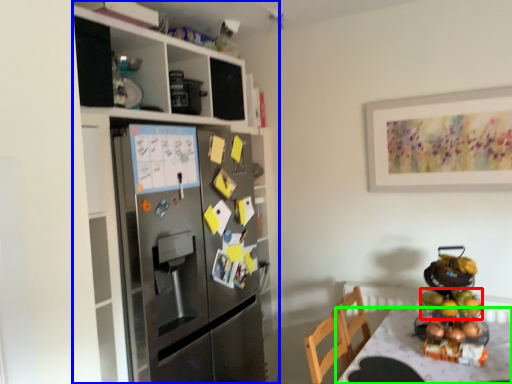
Question: Estimate the real-world distances between objects in this image. Which object is farther from fruit (highlighted by a red box), cabinetry (highlighted by a blue box) or desk (highlighted by a green box)?

Choices:
 (A) cabinetry
 (B) desk

Answer: (A)